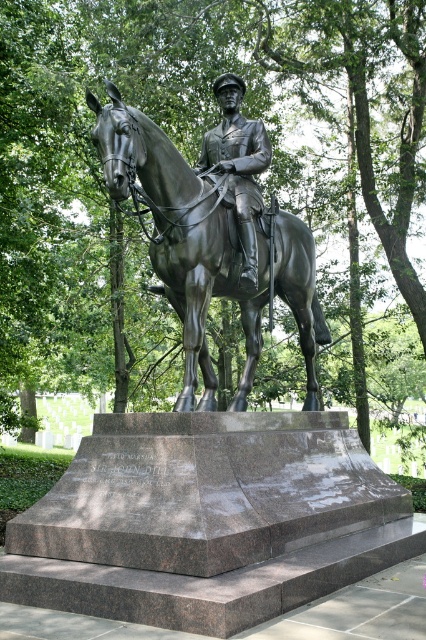
Question: Which of the following is the farthest from the observer?

Choices:
 (A) bronze statue of horse at center
 (B) bronze statue at center

Answer: (B)

Question: Does bronze statue of horse at center appear under bronze statue at center?

Choices:
 (A) yes
 (B) no

Answer: (A)

Question: Does bronze statue of horse at center appear under bronze statue at center?

Choices:
 (A) no
 (B) yes

Answer: (B)

Question: Is bronze statue of horse at center positioned in front of bronze statue at center?

Choices:
 (A) no
 (B) yes

Answer: (B)